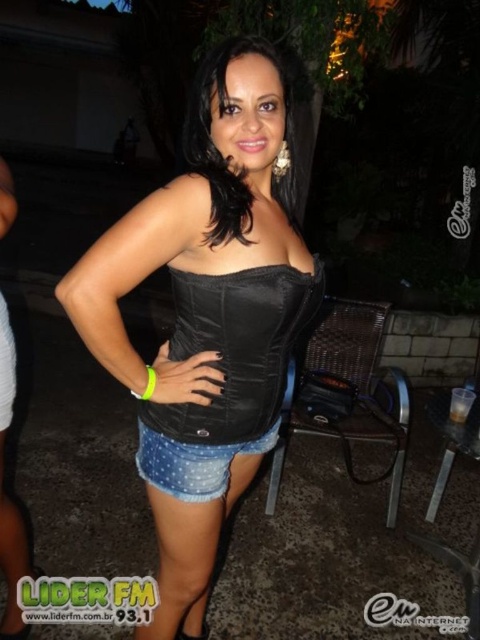
You are a photographer adjusting your camera to focus on two specific points in the image. The first point is point (109, 339) and the second is point (284, 204). If you want to capture both points in your photo, which point should you focus on first to ensure both are in focus?

To ensure both points are in focus, you should focus on point (284, 204) first because it is farther away from the camera than point (109, 339). This way, the depth of field will cover both points more effectively.